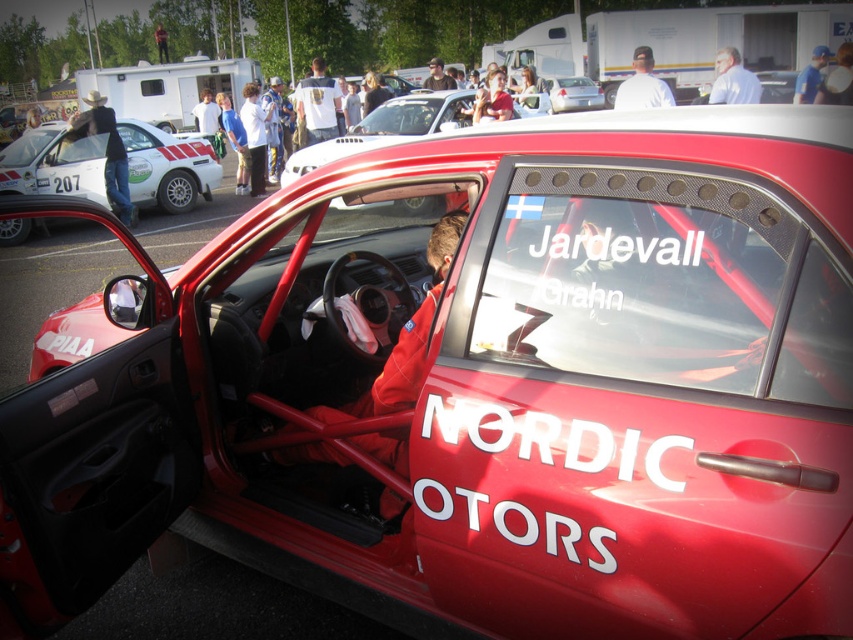
Question: Observing the image, what is the correct spatial positioning of matte white car at center in reference to matte black helmet at upper center?

Choices:
 (A) left
 (B) right

Answer: (B)

Question: Can you confirm if matte red car at center is thinner than matte black helmet at center?

Choices:
 (A) yes
 (B) no

Answer: (B)

Question: Can you confirm if matte white rally car at left is thinner than matte black helmet at center?

Choices:
 (A) yes
 (B) no

Answer: (A)

Question: Which point is farther to the camera?

Choices:
 (A) (427, 83)
 (B) (334, 132)
 (C) (741, 84)

Answer: (A)

Question: Estimate the real-world distances between objects in this image. Which object is closer to the blue fabric shirt at upper right?

Choices:
 (A) matte red car at center
 (B) white shirt at upper center
 (C) white t-shirt at center

Answer: (B)

Question: Which is farther from the light blue shirt at upper right?

Choices:
 (A) white t-shirt at upper center
 (B) denim jacket at left
 (C) matte white rally car at left
 (D) matte black helmet at upper center

Answer: (B)